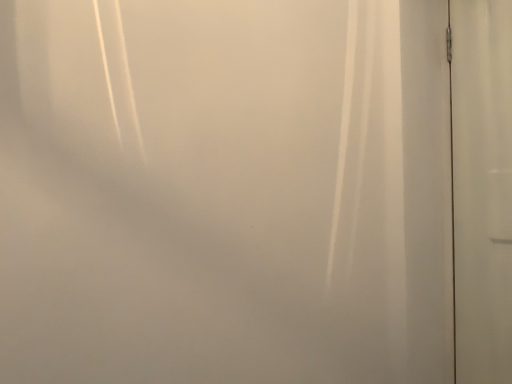
Describe the element at coordinates (482, 189) in the screenshot. I see `white matte screen door at right` at that location.

Measure the distance between white matte screen door at right and camera.

white matte screen door at right is 1.21 meters from camera.

Locate an element on the screen. The width and height of the screenshot is (512, 384). white matte screen door at right is located at coordinates (482, 189).

Identify the location of white matte screen door at right. (482, 189).